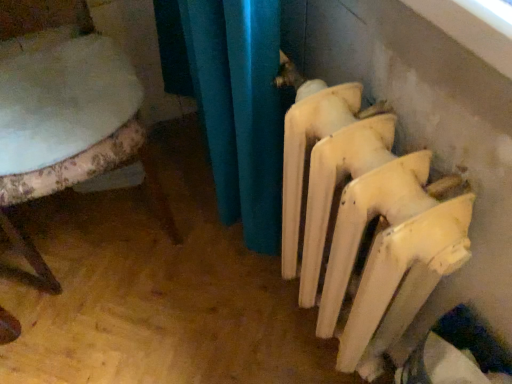
Where is `vacant area that is in front of white fabric chair at left`? The height and width of the screenshot is (384, 512). vacant area that is in front of white fabric chair at left is located at coordinates (112, 321).